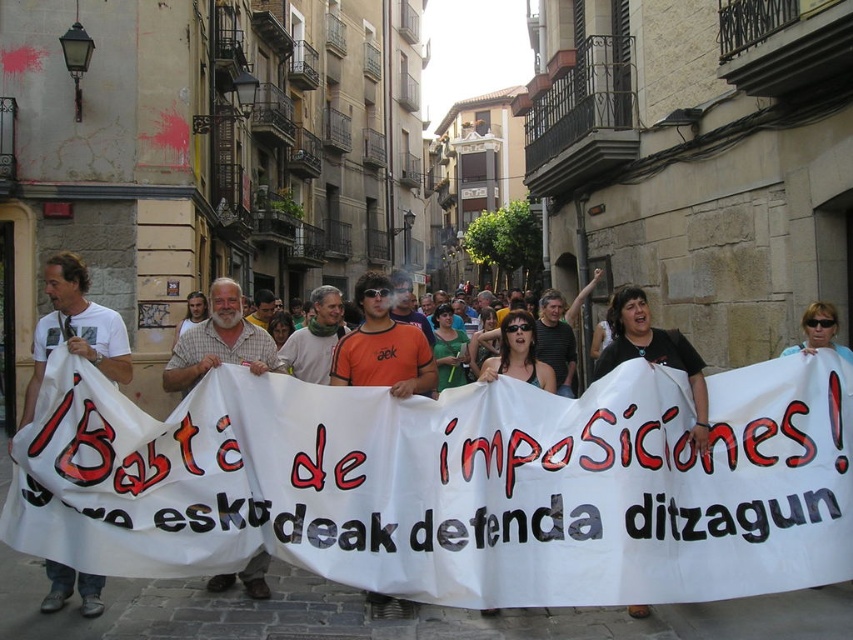
You are a photographer taking pictures of the protest. You notice two people in the crowd wearing a plaid cotton shirt at center and a black matte shirt at center. Which protester is standing behind the other?

The plaid cotton shirt at center is positioned under the black matte shirt at center, so the protester in the black matte shirt at center is standing behind the one in the plaid cotton shirt at center.